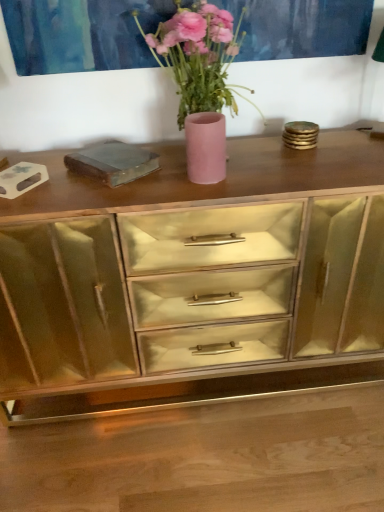
Find the location of a particular element. This screenshot has width=384, height=512. vacant space underneath pink matte vase at center (from a real-world perspective) is located at coordinates (226, 158).